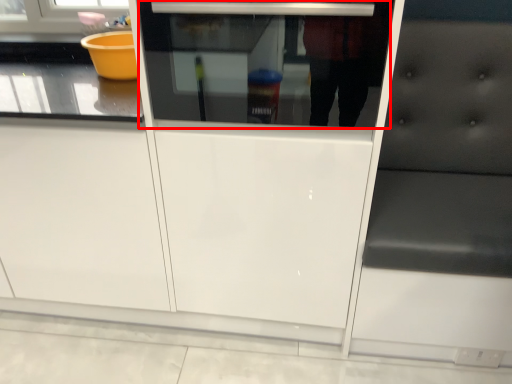
Question: Observing the image, what is the correct spatial positioning of oven (annotated by the red box) in reference to furniture?

Choices:
 (A) right
 (B) left

Answer: (B)